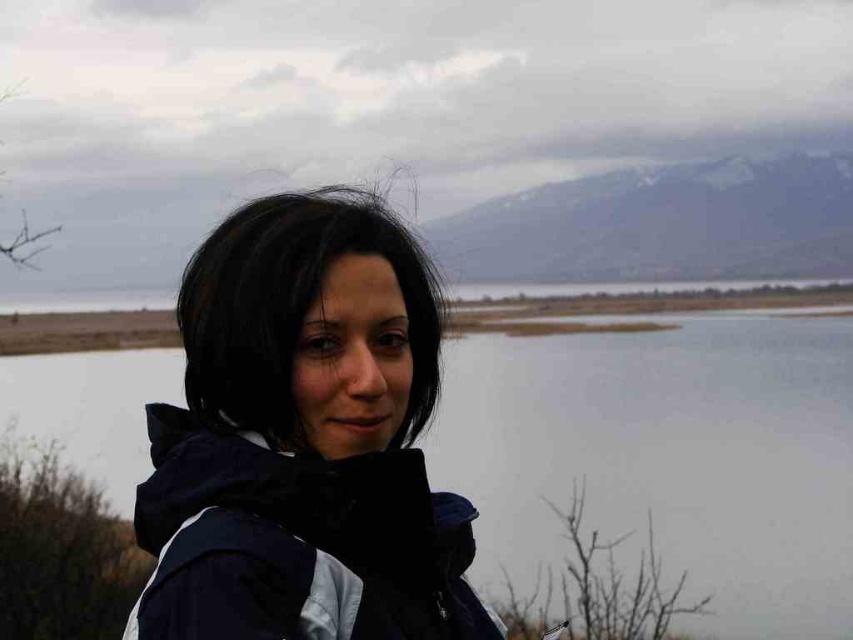
Is transparent water at center taller than black matte hair at center?

Correct, transparent water at center is much taller as black matte hair at center.

The width and height of the screenshot is (853, 640). What do you see at coordinates (666, 456) in the screenshot?
I see `transparent water at center` at bounding box center [666, 456].

Between point (804, 608) and point (276, 358), which one is positioned behind?

The point (804, 608) is behind.

The height and width of the screenshot is (640, 853). What are the coordinates of `transparent water at center` in the screenshot? It's located at (666, 456).

Can you confirm if transparent water at center is thinner than matte black jacket at center?

No.

Between transparent water at center and matte black jacket at center, which one has less height?

Standing shorter between the two is matte black jacket at center.

The width and height of the screenshot is (853, 640). Find the location of `transparent water at center`. transparent water at center is located at coordinates 666,456.

Does matte black jacket at center have a larger size compared to black matte hair at center?

Correct, matte black jacket at center is larger in size than black matte hair at center.

Who is more distant from viewer, (225, 368) or (352, 228)?

The point (352, 228) is behind.

You are a GUI agent. You are given a task and a screenshot of the screen. Output one action in this format:
    pyautogui.click(x=<x>, y=<y>)
    Task: Click on the matte black jacket at center
    The image size is (853, 640).
    Given the screenshot: What is the action you would take?
    305,440